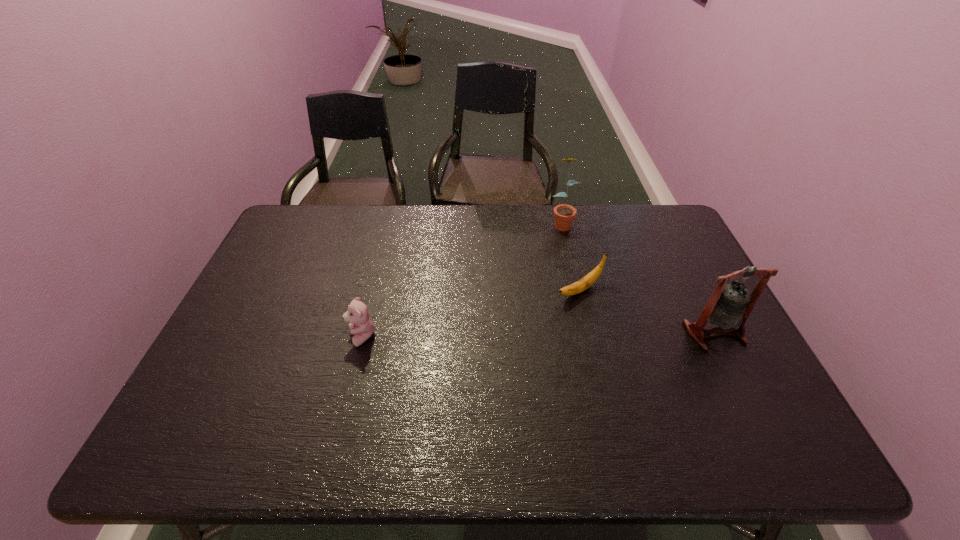
Find the location of a particular element. Image resolution: width=960 pixels, height=540 pixels. free space on the desktop that is between the third tallest object and the bell and is positioned on the flower of the sunflower is located at coordinates (592, 335).

You are a GUI agent. You are given a task and a screenshot of the screen. Output one action in this format:
    pyautogui.click(x=<x>, y=<y>)
    Task: Click on the free spot on the desktop that is between the leftmost object and the bell and is positioned on the peel of the shortest object from the top
    This screenshot has width=960, height=540.
    Given the screenshot: What is the action you would take?
    pyautogui.click(x=504, y=335)